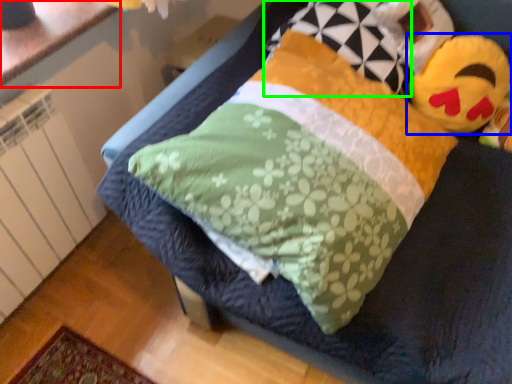
Question: Which object is the farthest from counter top (highlighted by a red box)? Choose among these: toy (highlighted by a blue box) or pillow (highlighted by a green box).

Choices:
 (A) toy
 (B) pillow

Answer: (A)